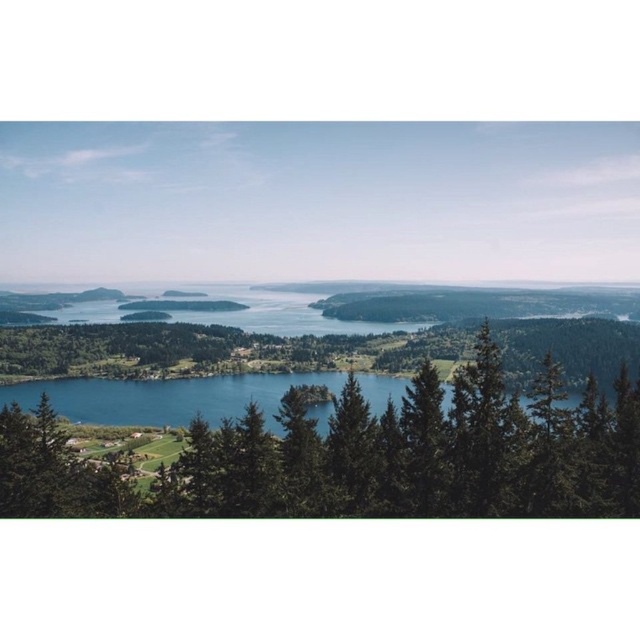
You are a hiker standing at the edge of the green textured tree at center. You want to reach the blue water at center. Based on their sizes, which one would you say is closer to you?

The green textured tree at center is larger in size than the blue water at center. Since objects closer to the observer appear larger, the green textured tree at center is closer to you than the blue water at center.

You are standing in the serene landscape and want to take a photo of both the green textured tree at center and the blue water at center. Which object will appear larger in your photo?

The green textured tree at center will appear larger in the photo because it is closer to the viewer than the blue water at center.

You are standing at the edge of the landscape looking towards the center. Which object, the green textured tree at center or the blue water at center, is closer to you?

The green textured tree at center is closer to you because it is taller than the blue water at center, indicating it is in a foreground position.